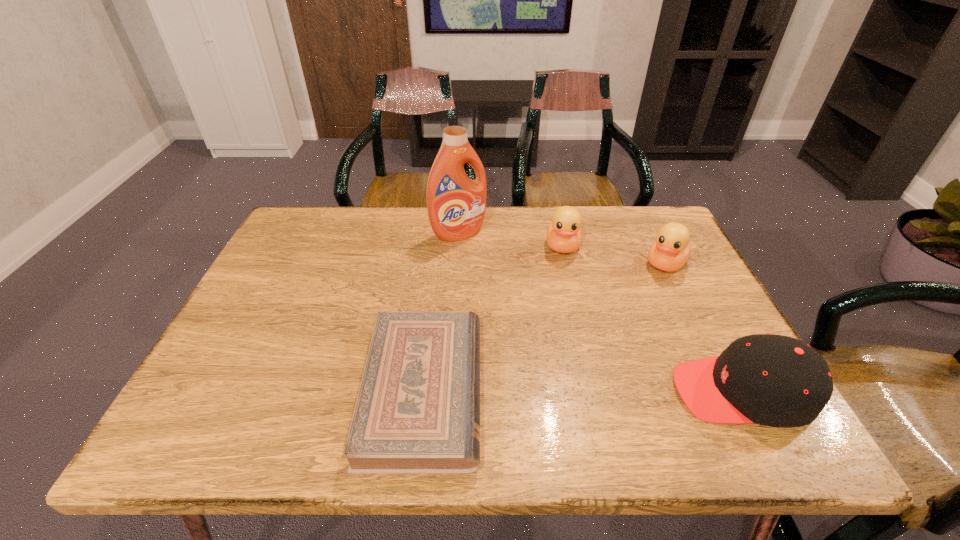
This screenshot has height=540, width=960. What are the coordinates of `vacant space on the desktop that is between the shortest object and the cap and is positioned on the face of the left duckling` in the screenshot? It's located at (559, 390).

At what (x,y) coordinates should I click in order to perform the action: click on free space on the desktop that is between the Bible and the cap and is positioned on the face of the right duckling. Please return your answer as a coordinate pair (x, y). Image resolution: width=960 pixels, height=540 pixels. Looking at the image, I should click on (586, 391).

You are a GUI agent. You are given a task and a screenshot of the screen. Output one action in this format:
    pyautogui.click(x=<x>, y=<y>)
    Task: Click on the vacant space on the desktop that is between the shortest object and the cap and is positioned on the front-facing side of the detergent
    The width and height of the screenshot is (960, 540).
    Given the screenshot: What is the action you would take?
    pyautogui.click(x=586, y=391)